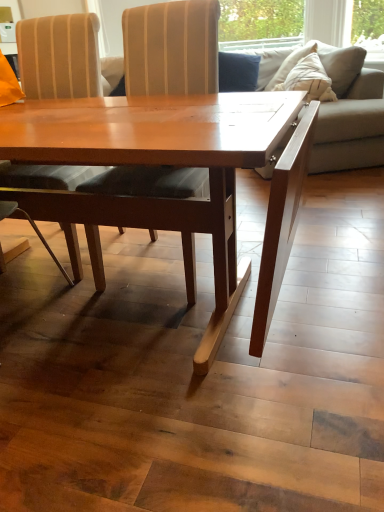
Locate an element on the screen. This screenshot has width=384, height=512. wooden striped chair at center, which appears as the 2th chair when viewed from the left is located at coordinates (171, 48).

The image size is (384, 512). Describe the element at coordinates (171, 48) in the screenshot. I see `wooden striped chair at center, which appears as the 2th chair when viewed from the left` at that location.

Describe the element at coordinates (59, 56) in the screenshot. The width and height of the screenshot is (384, 512). I see `matte wood chair at center, which ranks as the 2th chair in right-to-left order` at that location.

You are a GUI agent. You are given a task and a screenshot of the screen. Output one action in this format:
    pyautogui.click(x=<x>, y=<y>)
    Task: Click on the velvet blue pillow at upper center
    The height and width of the screenshot is (512, 384).
    Given the screenshot: What is the action you would take?
    pyautogui.click(x=238, y=72)

Locate an element on the screen. The height and width of the screenshot is (512, 384). wooden striped chair at center, arranged as the 1th chair when viewed from the right is located at coordinates (171, 48).

Considering the relative sizes of beige fabric couch at right and matte wood chair at center, which ranks as the 2th chair in right-to-left order, in the image provided, is beige fabric couch at right taller than matte wood chair at center, which ranks as the 2th chair in right-to-left order,?

In fact, beige fabric couch at right may be shorter than matte wood chair at center, which ranks as the 2th chair in right-to-left order.

Between beige fabric couch at right and matte wood chair at center, which ranks as the 2th chair in right-to-left order, which one has smaller size?

Smaller between the two is matte wood chair at center, which ranks as the 2th chair in right-to-left order.

Is beige fabric couch at right facing towards matte wood chair at center, which ranks as the 2th chair in right-to-left order?

No, beige fabric couch at right does not turn towards matte wood chair at center, which ranks as the 2th chair in right-to-left order.

Considering the positions of objects beige fabric couch at right and matte wood chair at center, which ranks as the 2th chair in right-to-left order, in the image provided, who is more to the left, beige fabric couch at right or matte wood chair at center, which ranks as the 2th chair in right-to-left order,?

matte wood chair at center, which ranks as the 2th chair in right-to-left order.

What's the angular difference between matte wood chair at center, which ranks as the 2th chair in right-to-left order, and beige fabric couch at right's facing directions?

They differ by 64 degrees in their facing directions.

Is matte wood chair at center, which ranks as the 2th chair in right-to-left order, looking in the opposite direction of beige fabric couch at right?

Correct, matte wood chair at center, which ranks as the 2th chair in right-to-left order, is looking away from beige fabric couch at right.

Is point (60, 184) positioned in front of point (322, 164)?

That is True.

In terms of width, does matte wood chair at center, which ranks as the 2th chair in right-to-left order, look wider or thinner when compared to beige fabric couch at right?

In the image, matte wood chair at center, which ranks as the 2th chair in right-to-left order, appears to be more narrow than beige fabric couch at right.

From a real-world perspective, is matte wood chair at center, which ranks as the 2th chair in right-to-left order, physically located above or below velvet blue pillow at upper center?

Clearly, from a real-world perspective, matte wood chair at center, which ranks as the 2th chair in right-to-left order, is below velvet blue pillow at upper center.

Can you confirm if matte wood chair at center, which appears as the first chair when viewed from the left, is bigger than velvet blue pillow at upper center?

Indeed, matte wood chair at center, which appears as the first chair when viewed from the left, has a larger size compared to velvet blue pillow at upper center.

Identify the location of the 1st chair in front of the velvet blue pillow at upper center. (59, 56).

Can you see matte wood chair at center, which appears as the first chair when viewed from the left, touching velvet blue pillow at upper center?

matte wood chair at center, which appears as the first chair when viewed from the left, and velvet blue pillow at upper center are clearly separated.

Which of these two, wooden striped chair at center, arranged as the 1th chair when viewed from the right, or matte wood chair at center, which ranks as the 2th chair in right-to-left order, is thinner?

matte wood chair at center, which ranks as the 2th chair in right-to-left order.

From a real-world perspective, is wooden striped chair at center, arranged as the 1th chair when viewed from the right, located beneath matte wood chair at center, which appears as the first chair when viewed from the left?

Yes.

Is wooden striped chair at center, arranged as the 1th chair when viewed from the right, positioned beyond the bounds of matte wood chair at center, which appears as the first chair when viewed from the left?

Absolutely, wooden striped chair at center, arranged as the 1th chair when viewed from the right, is external to matte wood chair at center, which appears as the first chair when viewed from the left.

Which of these two, wooden striped chair at center, which appears as the 2th chair when viewed from the left, or matte wood chair at center, which ranks as the 2th chair in right-to-left order, is bigger?

wooden striped chair at center, which appears as the 2th chair when viewed from the left.

Is the position of wooden striped chair at center, arranged as the 1th chair when viewed from the right, more distant than that of beige fabric couch at right?

No, the depth of wooden striped chair at center, arranged as the 1th chair when viewed from the right, is less than that of beige fabric couch at right.

How different are the orientations of wooden striped chair at center, which appears as the 2th chair when viewed from the left, and beige fabric couch at right in degrees?

The angle between the facing direction of wooden striped chair at center, which appears as the 2th chair when viewed from the left, and the facing direction of beige fabric couch at right is 64 degrees.

Which object is wider, wooden striped chair at center, arranged as the 1th chair when viewed from the right, or beige fabric couch at right?

beige fabric couch at right is wider.

Is wooden striped chair at center, arranged as the 1th chair when viewed from the right, situated inside beige fabric couch at right or outside?

wooden striped chair at center, arranged as the 1th chair when viewed from the right, is not enclosed by beige fabric couch at right.

Considering the relative positions of beige fabric couch at right and wooden striped chair at center, which appears as the 2th chair when viewed from the left, in the image provided, is beige fabric couch at right to the left or to the right of wooden striped chair at center, which appears as the 2th chair when viewed from the left,?

beige fabric couch at right is to the right of wooden striped chair at center, which appears as the 2th chair when viewed from the left.

From the image's perspective, which chair is the 2nd one below the beige fabric couch at right? Please provide its 2D coordinates.

[(171, 48)]

From the image's perspective, is beige fabric couch at right under wooden striped chair at center, arranged as the 1th chair when viewed from the right?

Actually, beige fabric couch at right appears above wooden striped chair at center, arranged as the 1th chair when viewed from the right, in the image.

Who is shorter, beige fabric couch at right or wooden striped chair at center, arranged as the 1th chair when viewed from the right?

beige fabric couch at right.

Measure the distance from wooden striped chair at center, arranged as the 1th chair when viewed from the right, to velvet blue pillow at upper center.

They are 7.83 feet apart.

Who is shorter, wooden striped chair at center, arranged as the 1th chair when viewed from the right, or velvet blue pillow at upper center?

Standing shorter between the two is velvet blue pillow at upper center.

From the image's perspective, is wooden striped chair at center, which appears as the 2th chair when viewed from the left, located above or below velvet blue pillow at upper center?

Clearly, from the image's perspective, wooden striped chair at center, which appears as the 2th chair when viewed from the left, is below velvet blue pillow at upper center.

Considering the sizes of objects wooden striped chair at center, which appears as the 2th chair when viewed from the left, and velvet blue pillow at upper center in the image provided, who is thinner, wooden striped chair at center, which appears as the 2th chair when viewed from the left, or velvet blue pillow at upper center?

velvet blue pillow at upper center.

You are a GUI agent. You are given a task and a screenshot of the screen. Output one action in this format:
    pyautogui.click(x=<x>, y=<y>)
    Task: Click on the 2nd chair to the left when counting from the beige fabric couch at right
    The width and height of the screenshot is (384, 512).
    Given the screenshot: What is the action you would take?
    pyautogui.click(x=59, y=56)

In the image, there is a matte wood chair at center, which ranks as the 2th chair in right-to-left order. Where is `studio couch above it (from the image's perspective)`? The width and height of the screenshot is (384, 512). studio couch above it (from the image's perspective) is located at coordinates (350, 114).

Looking at the image, which one is located further to beige fabric couch at right, wooden striped chair at center, which appears as the 2th chair when viewed from the left, or velvet blue pillow at upper center?

wooden striped chair at center, which appears as the 2th chair when viewed from the left, lies further to beige fabric couch at right than the other object.

Looking at this image, considering their positions, is beige fabric couch at right positioned further to wooden striped chair at center, arranged as the 1th chair when viewed from the right, than matte wood chair at center, which appears as the first chair when viewed from the left?

Based on the image, beige fabric couch at right appears to be further to wooden striped chair at center, arranged as the 1th chair when viewed from the right.

Which object lies nearer to the anchor point beige fabric couch at right, matte wood chair at center, which appears as the first chair when viewed from the left, or velvet blue pillow at upper center?

velvet blue pillow at upper center is positioned closer to the anchor beige fabric couch at right.

Looking at this image, looking at the image, which one is located further to matte wood chair at center, which appears as the first chair when viewed from the left, velvet blue pillow at upper center or wooden striped chair at center, which appears as the 2th chair when viewed from the left?

Based on the image, velvet blue pillow at upper center appears to be further to matte wood chair at center, which appears as the first chair when viewed from the left.

When comparing their distances from wooden striped chair at center, which appears as the 2th chair when viewed from the left, does velvet blue pillow at upper center or matte wood chair at center, which appears as the first chair when viewed from the left, seem closer?

The object closer to wooden striped chair at center, which appears as the 2th chair when viewed from the left, is matte wood chair at center, which appears as the first chair when viewed from the left.

Looking at the image, which one is located closer to matte wood chair at center, which appears as the first chair when viewed from the left, velvet blue pillow at upper center or beige fabric couch at right?

beige fabric couch at right lies closer to matte wood chair at center, which appears as the first chair when viewed from the left, than the other object.

Looking at this image, estimate the real-world distances between objects in this image. Which object is further from velvet blue pillow at upper center, wooden striped chair at center, which appears as the 2th chair when viewed from the left, or matte wood chair at center, which appears as the first chair when viewed from the left?

wooden striped chair at center, which appears as the 2th chair when viewed from the left, is positioned further to the anchor velvet blue pillow at upper center.

When comparing their distances from matte wood chair at center, which ranks as the 2th chair in right-to-left order, does beige fabric couch at right or velvet blue pillow at upper center seem further?

velvet blue pillow at upper center is further to matte wood chair at center, which ranks as the 2th chair in right-to-left order.

The image size is (384, 512). I want to click on chair located between wooden striped chair at center, which appears as the 2th chair when viewed from the left, and velvet blue pillow at upper center in the depth direction, so click(x=59, y=56).

Locate an element on the screen. chair situated between matte wood chair at center, which ranks as the 2th chair in right-to-left order, and beige fabric couch at right from left to right is located at coordinates (171, 48).

This screenshot has height=512, width=384. Identify the location of studio couch between matte wood chair at center, which ranks as the 2th chair in right-to-left order, and velvet blue pillow at upper center from front to back. (350, 114).

You are a GUI agent. You are given a task and a screenshot of the screen. Output one action in this format:
    pyautogui.click(x=<x>, y=<y>)
    Task: Click on the studio couch positioned between wooden striped chair at center, arranged as the 1th chair when viewed from the right, and velvet blue pillow at upper center from near to far
    
    Given the screenshot: What is the action you would take?
    pyautogui.click(x=350, y=114)